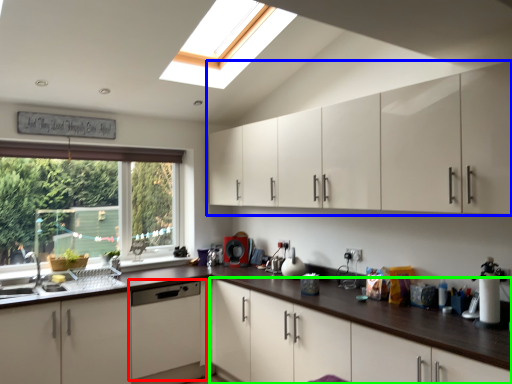
Question: Based on their relative distances, which object is nearer to home appliance (highlighted by a red box)? Choose from cabinetry (highlighted by a blue box) and cabinetry (highlighted by a green box).

Choices:
 (A) cabinetry
 (B) cabinetry

Answer: (B)